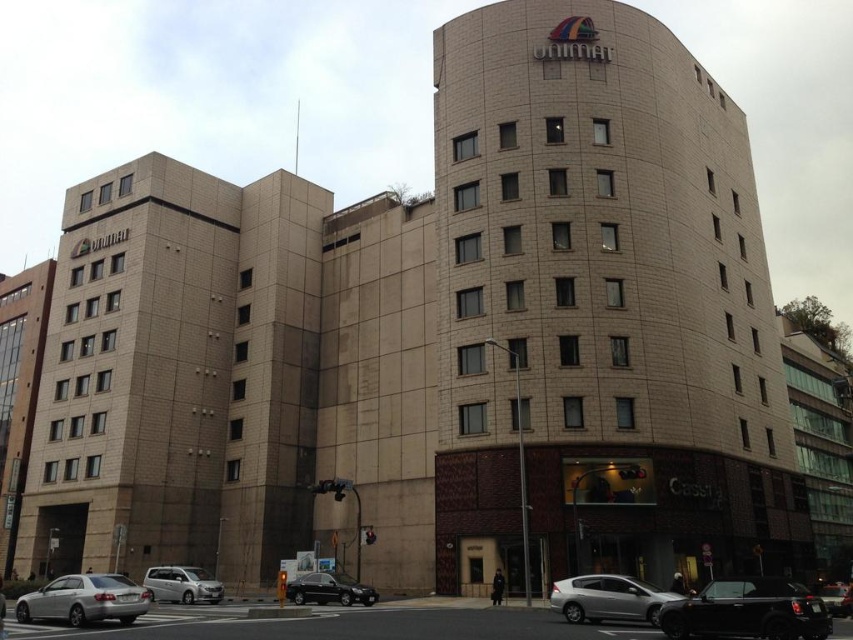
You are a delivery driver who needs to park your vehicle in the space between the shiny black car at lower right and the silver metallic sedan at lower left. Your truck is 2.5 meters wide. Can you fit your truck in that space?

The shiny black car at lower right is narrower than the silver metallic sedan at lower left, but the exact width of the space between them isn

You are a delivery driver who needs to park your shiny black sedan at lower center as close as possible to the beige brick building at center. According to the scene description, what is the minimum distance you can achieve between your car and the building?

The minimum distance you can achieve between the shiny black sedan at lower center and the beige brick building at center is 92.50 feet, as they are currently 92.50 feet apart from each other.